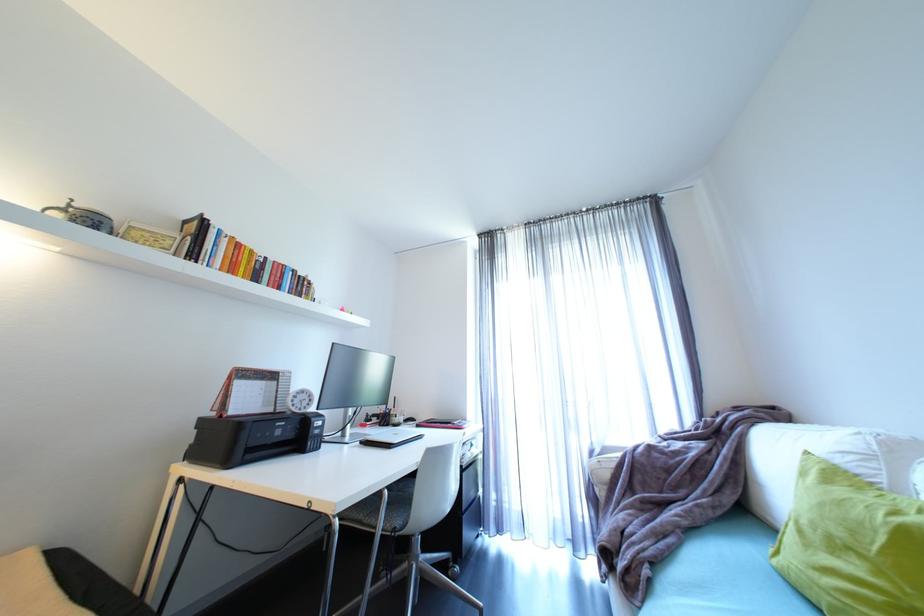
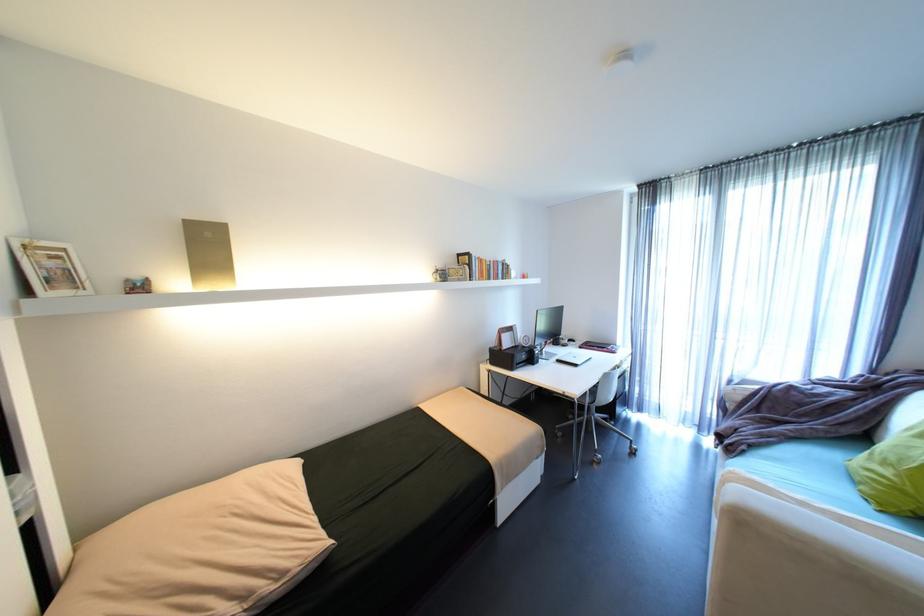
In the second image, find the point that corresponds to point (79, 200) in the first image.

(444, 267)